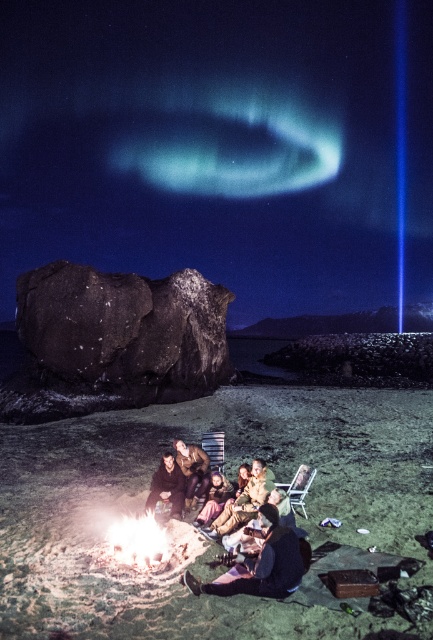
Does dark matte rock at center appear under metallic silver chair at lower center?

Incorrect, dark matte rock at center is not positioned below metallic silver chair at lower center.

Who is more forward, [207,332] or [307,476]?

Point [307,476] is in front.

Does point (23, 310) come farther from viewer compared to point (290, 483)?

Yes, it is behind point (290, 483).

The height and width of the screenshot is (640, 433). I want to click on dark matte rock at center, so click(123, 332).

Locate an element on the screen. This screenshot has width=433, height=640. flaming wood fire at lower center is located at coordinates (138, 540).

In the scene shown: Which of these two, flaming wood fire at lower center or light brown leather jacket at center, stands shorter?

flaming wood fire at lower center is shorter.

Is point (133, 545) positioned in front of point (264, 468)?

Yes.

Where is `flaming wood fire at lower center`? This screenshot has width=433, height=640. flaming wood fire at lower center is located at coordinates (138, 540).

Which of these two, dark brown leather jacket at lower center or brown leather jacket at center, stands shorter?

brown leather jacket at center is shorter.

Is dark brown leather jacket at lower center behind brown leather jacket at center?

No, dark brown leather jacket at lower center is closer to the viewer.

Is point (277, 544) more distant than point (222, 488)?

No.

The width and height of the screenshot is (433, 640). Find the location of `dark brown leather jacket at lower center`. dark brown leather jacket at lower center is located at coordinates (258, 563).